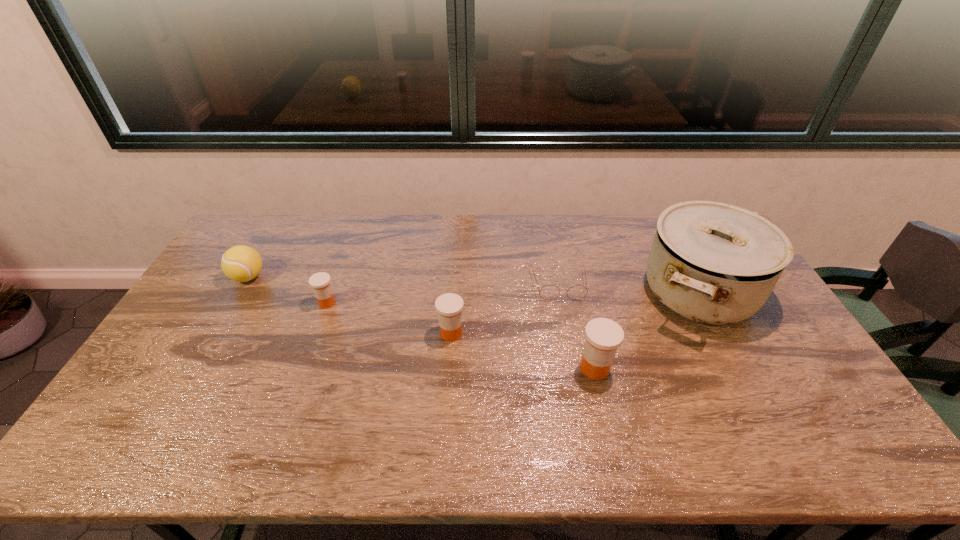
Please point a spot on the right to add another medicine. Please provide its 2D coordinates. Your answer should be formatted as a tuple, i.e. [(x, y)], where the tuple contains the x and y coordinates of a point satisfying the conditions above.

[(762, 409)]